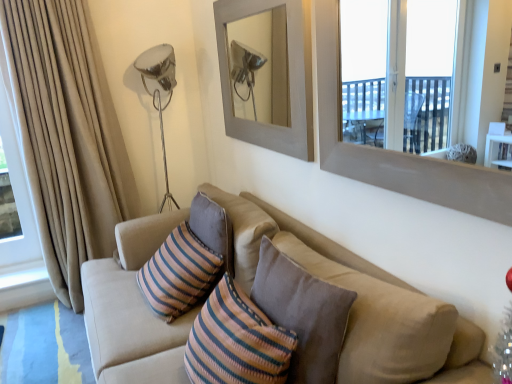
Image resolution: width=512 pixels, height=384 pixels. What are the coordinates of `beige fabric curtain at left` in the screenshot? It's located at (67, 136).

Image resolution: width=512 pixels, height=384 pixels. Describe the element at coordinates (396, 151) in the screenshot. I see `smooth gray window frame at upper right` at that location.

The image size is (512, 384). What do you see at coordinates (289, 77) in the screenshot?
I see `gray matte picture frame at upper center` at bounding box center [289, 77].

Identify the location of beige fabric curtain at left. (67, 136).

From a real-world perspective, is smooth gray window frame at upper right positioned above or below beige fabric curtain at left?

smooth gray window frame at upper right is situated higher than beige fabric curtain at left in the real world.

In terms of width, does smooth gray window frame at upper right look wider or thinner when compared to beige fabric curtain at left?

Clearly, smooth gray window frame at upper right has less width compared to beige fabric curtain at left.

In the scene shown: Can you confirm if smooth gray window frame at upper right is positioned to the right of beige fabric curtain at left?

Yes, smooth gray window frame at upper right is to the right of beige fabric curtain at left.

The height and width of the screenshot is (384, 512). I want to click on studio couch below the smooth gray window frame at upper right (from a real-world perspective), so (369, 305).

Is point (158, 238) closer to viewer compared to point (316, 0)?

No, (158, 238) is behind (316, 0).

Is beige fabric couch at center with smooth gray window frame at upper right?

No, beige fabric couch at center is not making contact with smooth gray window frame at upper right.

Consider the image. Between beige fabric couch at center and smooth gray window frame at upper right, which one has less height?

With less height is smooth gray window frame at upper right.

Considering the sizes of objects smooth gray window frame at upper right and gray matte picture frame at upper center in the image provided, who is taller, smooth gray window frame at upper right or gray matte picture frame at upper center?

With more height is gray matte picture frame at upper center.

How far apart are smooth gray window frame at upper right and gray matte picture frame at upper center?

smooth gray window frame at upper right is 45.21 centimeters away from gray matte picture frame at upper center.

Is point (402, 185) behind point (310, 20)?

No, (402, 185) is closer to viewer.

Between point (298, 61) and point (62, 49), which one is positioned in front?

Positioned in front is point (298, 61).

Can you confirm if gray matte picture frame at upper center is wider than beige fabric curtain at left?

No.

Choose the correct answer: Is gray matte picture frame at upper center inside beige fabric curtain at left or outside it?

gray matte picture frame at upper center is not enclosed by beige fabric curtain at left.

Between point (93, 141) and point (112, 376), which one is positioned in front?

The point (112, 376) is more forward.

From the image's perspective, which one is positioned lower, beige fabric curtain at left or beige fabric couch at center?

beige fabric couch at center is shown below in the image.

The height and width of the screenshot is (384, 512). In order to click on curtain that appears on the left of beige fabric couch at center in this screenshot , I will do `click(67, 136)`.

Which is more to the right, beige fabric curtain at left or beige fabric couch at center?

beige fabric couch at center.

Considering the sizes of gray matte picture frame at upper center and beige fabric couch at center in the image, is gray matte picture frame at upper center wider or thinner than beige fabric couch at center?

gray matte picture frame at upper center is thinner than beige fabric couch at center.

Is gray matte picture frame at upper center situated inside beige fabric couch at center or outside?

gray matte picture frame at upper center cannot be found inside beige fabric couch at center.

Does gray matte picture frame at upper center lie in front of beige fabric couch at center?

No, it is behind beige fabric couch at center.

This screenshot has height=384, width=512. In order to click on picture frame behind the beige fabric couch at center in this screenshot , I will do `click(289, 77)`.

In terms of size, does beige fabric couch at center appear bigger or smaller than beige fabric curtain at left?

Considering their sizes, beige fabric couch at center takes up more space than beige fabric curtain at left.

Who is shorter, beige fabric couch at center or beige fabric curtain at left?

With less height is beige fabric couch at center.

From the picture: Which is behind, beige fabric couch at center or beige fabric curtain at left?

beige fabric curtain at left is further away from the camera.

Can you tell me how much beige fabric couch at center and beige fabric curtain at left differ in facing direction?

They differ by 89 degrees in their facing directions.

You are a GUI agent. You are given a task and a screenshot of the screen. Output one action in this format:
    pyautogui.click(x=<x>, y=<y>)
    Task: Click on the window frame in front of the beige fabric curtain at left
    
    Given the screenshot: What is the action you would take?
    pyautogui.click(x=396, y=151)

I want to click on window frame on the right of beige fabric couch at center, so click(x=396, y=151).

Looking at the image, which one is located closer to gray matte picture frame at upper center, beige fabric curtain at left or beige fabric couch at center?

The object closer to gray matte picture frame at upper center is beige fabric couch at center.

Which object lies nearer to the anchor point gray matte picture frame at upper center, beige fabric couch at center or beige fabric curtain at left?

beige fabric couch at center is positioned closer to the anchor gray matte picture frame at upper center.

Looking at the image, which one is located further to smooth gray window frame at upper right, beige fabric couch at center or beige fabric curtain at left?

The object further to smooth gray window frame at upper right is beige fabric curtain at left.

Estimate the real-world distances between objects in this image. Which object is further from beige fabric curtain at left, gray matte picture frame at upper center or beige fabric couch at center?

The object further to beige fabric curtain at left is beige fabric couch at center.

From the image, which object appears to be farther from beige fabric curtain at left, beige fabric couch at center or gray matte picture frame at upper center?

Based on the image, beige fabric couch at center appears to be further to beige fabric curtain at left.

When comparing their distances from gray matte picture frame at upper center, does beige fabric couch at center or smooth gray window frame at upper right seem further?

beige fabric couch at center lies further to gray matte picture frame at upper center than the other object.

Based on their spatial positions, is smooth gray window frame at upper right or beige fabric curtain at left closer to beige fabric couch at center?

Among the two, smooth gray window frame at upper right is located nearer to beige fabric couch at center.

Considering their positions, is smooth gray window frame at upper right positioned closer to beige fabric curtain at left than beige fabric couch at center?

Based on the image, beige fabric couch at center appears to be nearer to beige fabric curtain at left.

The width and height of the screenshot is (512, 384). What are the coordinates of `picture frame between beige fabric curtain at left and smooth gray window frame at upper right in the horizontal direction` in the screenshot? It's located at (289, 77).

Where is `picture frame located between beige fabric couch at center and beige fabric curtain at left in the depth direction`? The width and height of the screenshot is (512, 384). picture frame located between beige fabric couch at center and beige fabric curtain at left in the depth direction is located at coordinates (289, 77).

You are a GUI agent. You are given a task and a screenshot of the screen. Output one action in this format:
    pyautogui.click(x=<x>, y=<y>)
    Task: Click on the window frame between beige fabric couch at center and beige fabric curtain at left from front to back
    Image resolution: width=512 pixels, height=384 pixels.
    Given the screenshot: What is the action you would take?
    pyautogui.click(x=396, y=151)

Locate an element on the screen. This screenshot has height=384, width=512. window frame that lies between gray matte picture frame at upper center and beige fabric couch at center from top to bottom is located at coordinates (396, 151).